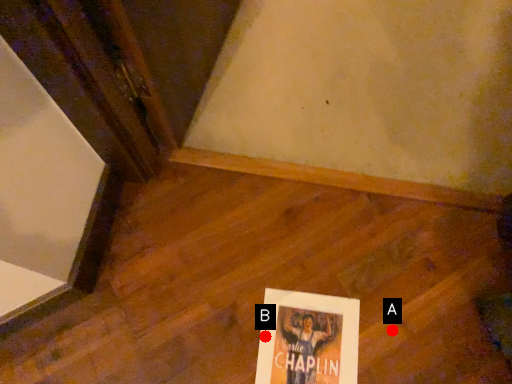
Question: Two points are circled on the image, labeled by A and B beside each circle. Which point is farther from the camera taking this photo?

Choices:
 (A) A is further
 (B) B is further

Answer: (A)